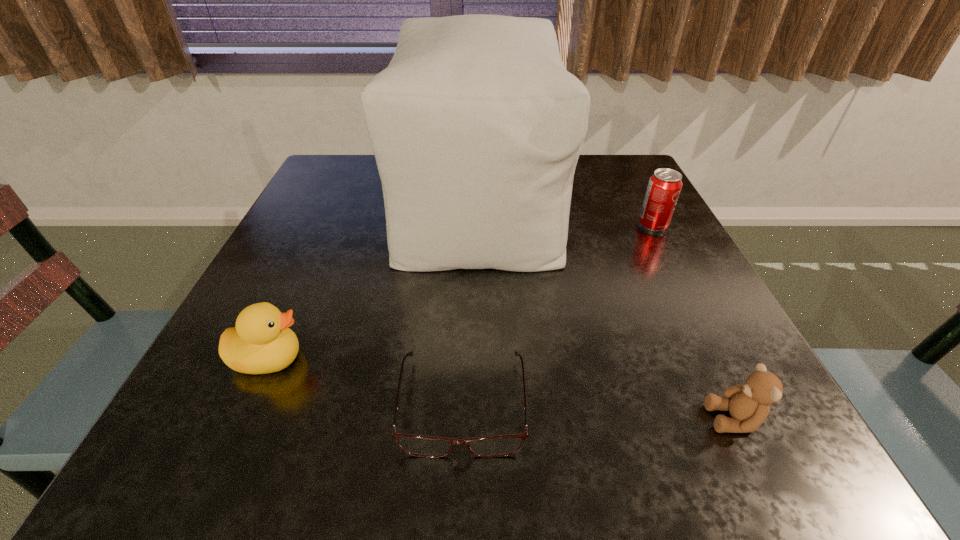
Where is `cushion`? This screenshot has width=960, height=540. cushion is located at coordinates (476, 126).

Locate an element on the screen. soda is located at coordinates (664, 186).

This screenshot has width=960, height=540. What are the coordinates of `duckling` in the screenshot? It's located at (261, 342).

Find the location of a particular element. The height and width of the screenshot is (540, 960). the fourth tallest object is located at coordinates (748, 404).

Image resolution: width=960 pixels, height=540 pixels. Find the location of `spectacles`. spectacles is located at coordinates (417, 445).

Locate an element on the screen. vacant area located 0.090m on the side of the cushion with the smiley face is located at coordinates (598, 204).

In order to click on free location located on the back of the soda in this screenshot , I will do `click(623, 168)`.

I want to click on vacant area situated 0.130m on the face of the leftmost object, so click(390, 359).

Find the location of a particular element. vacant space located 0.060m on the front-facing side of the fourth tallest object is located at coordinates (664, 419).

Find the location of a particular element. free location located on the front-facing side of the fourth tallest object is located at coordinates (606, 419).